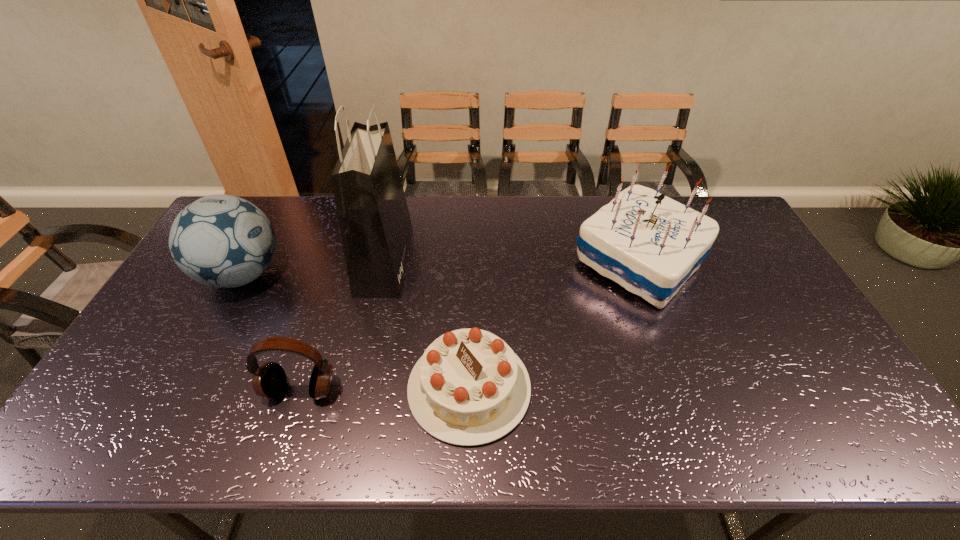
This screenshot has width=960, height=540. In order to click on the tallest object in this screenshot , I will do `click(375, 224)`.

Find the location of a particular element. The image size is (960, 540). the rightmost object is located at coordinates (650, 244).

Find the location of a particular element. Image resolution: width=960 pixels, height=540 pixels. the farther birthday cake is located at coordinates (650, 244).

The width and height of the screenshot is (960, 540). Find the location of `soccer ball`. soccer ball is located at coordinates (223, 241).

Where is `headset`? headset is located at coordinates (269, 381).

At what (x,y) coordinates should I click in order to perform the action: click on the fourth object from left to right. Please return your answer as a coordinate pair (x, y). Looking at the image, I should click on (469, 388).

Where is `the nearer birthday cake`? the nearer birthday cake is located at coordinates (469, 388).

Find the location of a particular element. Image resolution: width=960 pixels, height=540 pixels. vacant space located on the front with handles of the tallest object is located at coordinates (432, 260).

Find the location of `vacant space situated on the front of the taller birthday cake`. vacant space situated on the front of the taller birthday cake is located at coordinates (688, 393).

The width and height of the screenshot is (960, 540). Find the location of `vacant space located 0.360m on the side with brand of the soccer ball`. vacant space located 0.360m on the side with brand of the soccer ball is located at coordinates (400, 275).